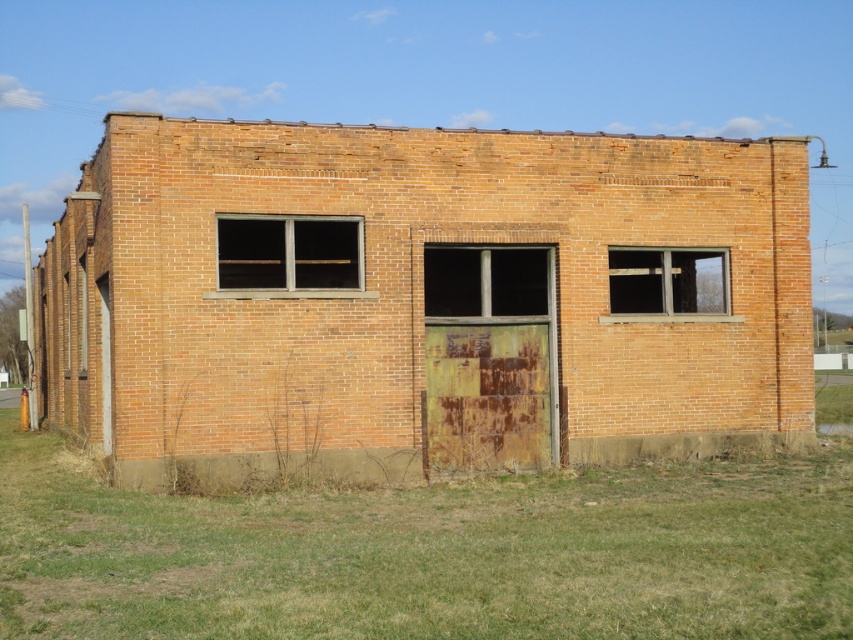
Can you confirm if green grass at lower center is taller than matte gray window at center right?

No.

Between point (274, 628) and point (709, 262), which one is positioned behind?

The point (709, 262) is more distant.

Between point (422, 557) and point (685, 269), which one is positioned in front?

Point (422, 557) is more forward.

Where is `green grass at lower center`? Image resolution: width=853 pixels, height=640 pixels. green grass at lower center is located at coordinates (432, 554).

Does clear glass window at center appear under matte gray window at center right?

Actually, clear glass window at center is above matte gray window at center right.

Between point (322, 234) and point (721, 275), which one is positioned in front?

Point (322, 234) is in front.

Locate an element on the screen. Image resolution: width=853 pixels, height=640 pixels. clear glass window at center is located at coordinates (288, 253).

The height and width of the screenshot is (640, 853). Describe the element at coordinates (432, 554) in the screenshot. I see `green grass at lower center` at that location.

This screenshot has width=853, height=640. I want to click on green grass at lower center, so click(x=432, y=554).